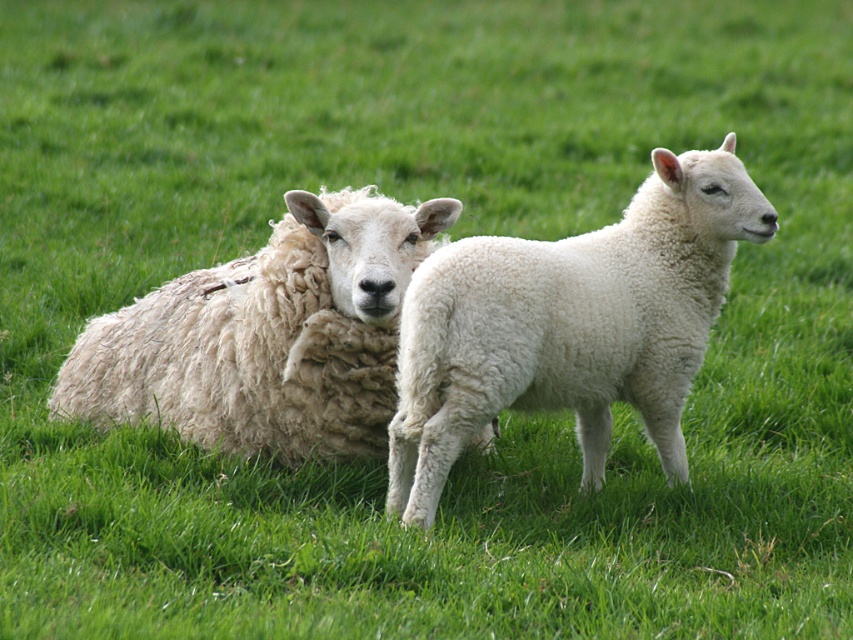
Between white fluffy lamb at center and white woolen sheep at center, which one is positioned higher?

Positioned higher is white woolen sheep at center.

Does white fluffy lamb at center appear under white woolen sheep at center?

Yes.

Who is more forward, (553,353) or (247,323)?

Positioned in front is point (553,353).

Locate an element on the screen. The image size is (853, 640). white fluffy lamb at center is located at coordinates (570, 324).